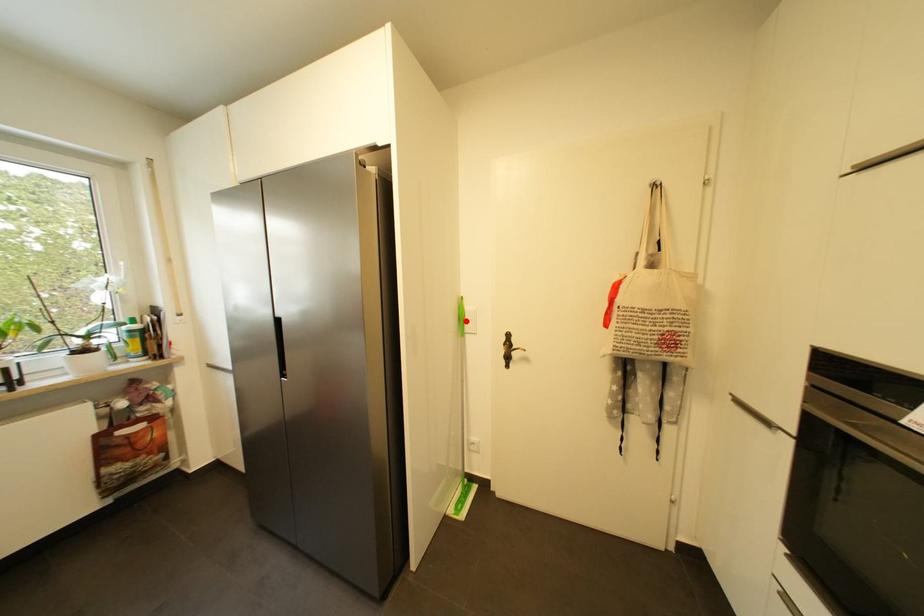
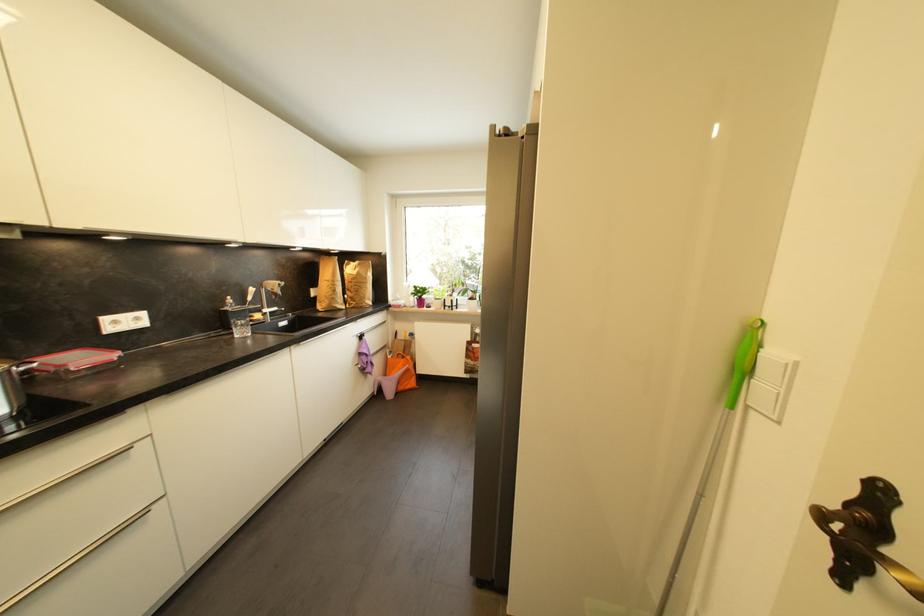
The point at the highlighted location is marked in the first image. Where is the corresponding point in the second image?

(746, 371)